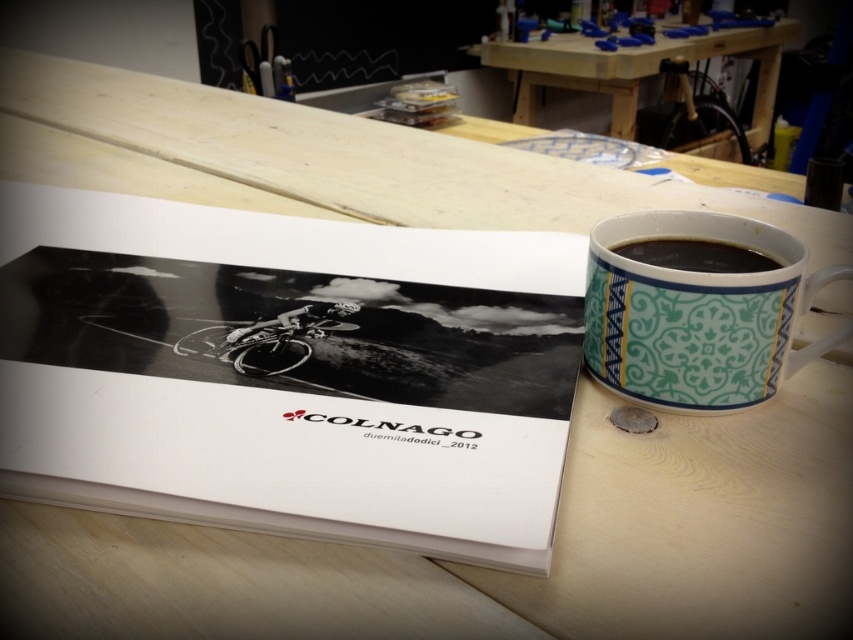
You are looking at the workspace and want to place a new object between the two points labeled as point [514,461] and point [640,246]. Which point should the object be closer to in order to appear closer to the camera?

The object should be placed closer to point [514,461] because it is closer to the camera than point [640,246].

You need to place a new object on the wooden table at upper center and the black glossy mug at upper right. Which surface has enough space for a larger object?

The wooden table at upper center has a larger size compared to the black glossy mug at upper right, so it has more space to place a larger object.